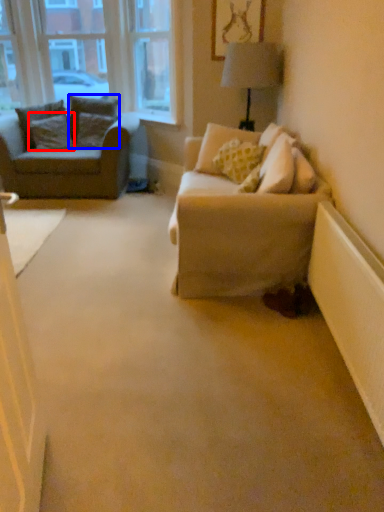
Question: Which object is closer to the camera taking this photo, pillow (highlighted by a red box) or pillow (highlighted by a blue box)?

Choices:
 (A) pillow
 (B) pillow

Answer: (A)